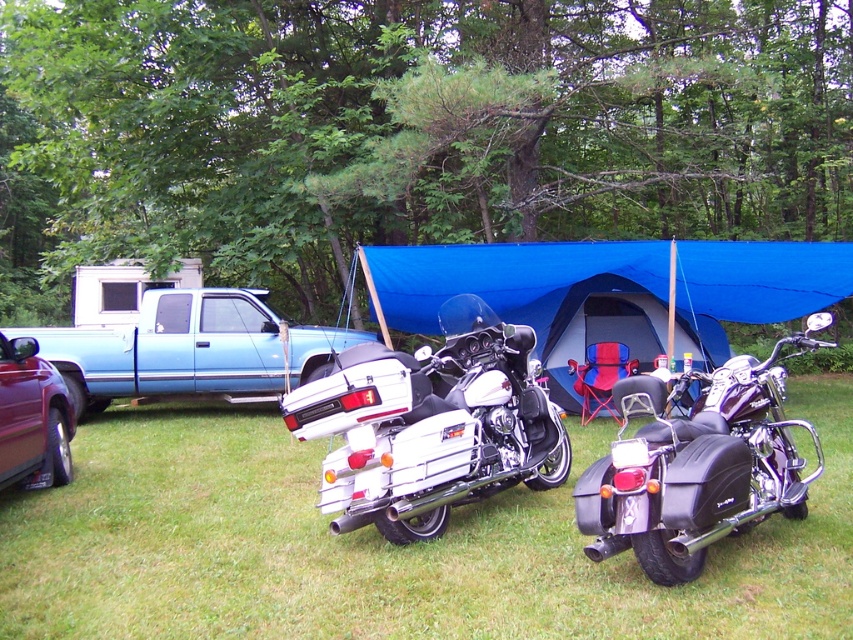
You are a hiker who wants to take a photo of the white metallic motorcycle at center and the metallic maroon car at lower left. From your current position, which object is positioned higher in the image?

The white metallic motorcycle at center is positioned higher than the metallic maroon car at lower left in the image.

You are standing at the point marked by the coordinates point (384, 547). What is the primary surface you are standing on?

The point (384, 547) corresponds to green grass at center, so you are standing on green grass at center.

You are planning to set up a campsite and need to place a new tent. The current setup has a white metallic motorcycle at center. Based on the scene description, where should you place the new tent to avoid blocking the motorcycle?

The white metallic motorcycle at center is located at point (431, 426). To avoid blocking it, the new tent should be placed away from this coordinate, possibly behind or to the sides where there is space not occupied by the motorcycle.